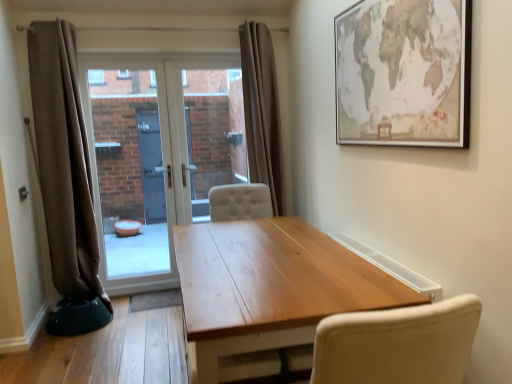
Question: From a real-world perspective, is matte paper map at upper right beneath white glossy door at center?

Choices:
 (A) yes
 (B) no

Answer: (B)

Question: From the image's perspective, is matte paper map at upper right above white glossy door at center?

Choices:
 (A) yes
 (B) no

Answer: (A)

Question: Is matte paper map at upper right beside white glossy door at center?

Choices:
 (A) no
 (B) yes

Answer: (A)

Question: Is white glossy door at center a part of matte paper map at upper right?

Choices:
 (A) no
 (B) yes

Answer: (A)

Question: Is matte paper map at upper right positioned behind white glossy door at center?

Choices:
 (A) no
 (B) yes

Answer: (A)

Question: From the image's perspective, is transparent glass door at center, which is the second window screen from left to right, located above or below matte paper map at upper right?

Choices:
 (A) below
 (B) above

Answer: (A)

Question: In terms of width, does transparent glass door at center, acting as the 1th window screen starting from the right, look wider or thinner when compared to matte paper map at upper right?

Choices:
 (A) thin
 (B) wide

Answer: (B)

Question: From a real-world perspective, is transparent glass door at center, acting as the 1th window screen starting from the right, above or below matte paper map at upper right?

Choices:
 (A) below
 (B) above

Answer: (A)

Question: Would you say transparent glass door at center, acting as the 1th window screen starting from the right, is to the left or to the right of matte paper map at upper right in the picture?

Choices:
 (A) right
 (B) left

Answer: (B)

Question: Looking at their shapes, would you say brown fabric curtain at left, which is the 2th curtain from right to left, is wider or thinner than transparent glass door at center, which is counted as the 1th window screen, starting from the left?

Choices:
 (A) thin
 (B) wide

Answer: (B)

Question: Would you say brown fabric curtain at left, which is the 2th curtain from right to left, is to the left or to the right of transparent glass door at center, which is counted as the 1th window screen, starting from the left, in the picture?

Choices:
 (A) right
 (B) left

Answer: (B)

Question: Considering the positions of brown fabric curtain at left, which is the 2th curtain from right to left, and transparent glass door at center, which is counted as the 1th window screen, starting from the left, in the image, is brown fabric curtain at left, which is the 2th curtain from right to left, taller or shorter than transparent glass door at center, which is counted as the 1th window screen, starting from the left,?

Choices:
 (A) tall
 (B) short

Answer: (A)

Question: Is brown fabric curtain at left, the 1th curtain from the left, bigger or smaller than transparent glass door at center, which is the 2th window screen from right to left?

Choices:
 (A) small
 (B) big

Answer: (B)

Question: From a real-world perspective, is brown fabric curtain at left, the 1th curtain from the left, physically located above or below wooden table at center?

Choices:
 (A) above
 (B) below

Answer: (A)

Question: Considering the positions of brown fabric curtain at left, the 1th curtain from the left, and wooden table at center in the image, is brown fabric curtain at left, the 1th curtain from the left, wider or thinner than wooden table at center?

Choices:
 (A) thin
 (B) wide

Answer: (A)